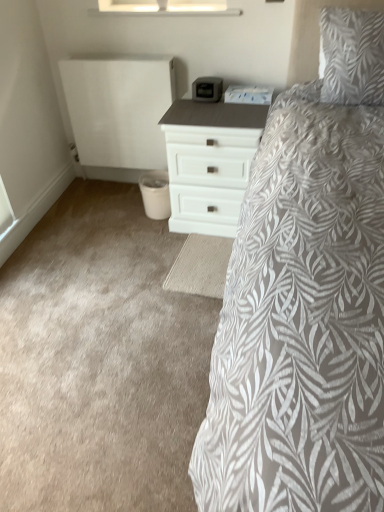
Where is `free space above white matte chest of drawers at center (from a real-world perspective)`? Image resolution: width=384 pixels, height=512 pixels. free space above white matte chest of drawers at center (from a real-world perspective) is located at coordinates (233, 98).